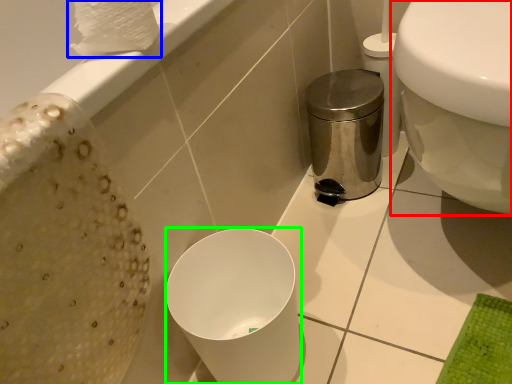
Question: Which object is positioned farthest from toilet (highlighted by a red box)? Select from toilet paper (highlighted by a blue box) and bidet (highlighted by a green box).

Choices:
 (A) toilet paper
 (B) bidet

Answer: (A)